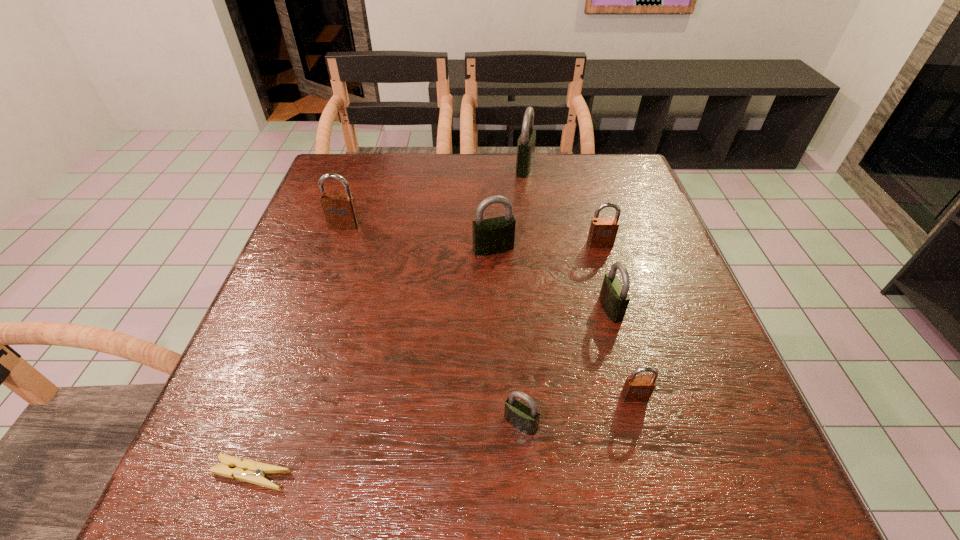
Identify the location of the sixth farthest object. (636, 388).

Identify the location of the smallest brown padlock. The width and height of the screenshot is (960, 540). (636, 388).

This screenshot has height=540, width=960. What are the coordinates of `clothespin` in the screenshot? It's located at tap(249, 471).

Locate an element on the screen. The width and height of the screenshot is (960, 540). the nearest object is located at coordinates (249, 471).

Where is `free region located 0.300m on the left of the fourth padlock from right to left`? This screenshot has height=540, width=960. free region located 0.300m on the left of the fourth padlock from right to left is located at coordinates (413, 167).

You are a GUI agent. You are given a task and a screenshot of the screen. Output one action in this format:
    pyautogui.click(x=<x>, y=<y>)
    Task: Click on the vacant region located on the back of the third nearest black padlock
    The width and height of the screenshot is (960, 540).
    Given the screenshot: What is the action you would take?
    pyautogui.click(x=492, y=191)

This screenshot has width=960, height=540. In order to click on vacant space situated on the front-facing side of the sixth nearest padlock in this screenshot , I will do `click(338, 245)`.

You are a GUI agent. You are given a task and a screenshot of the screen. Output one action in this format:
    pyautogui.click(x=<x>, y=<y>)
    Task: Click on the free point located on the front-facing side of the second smallest brown padlock
    This screenshot has height=540, width=960.
    Given the screenshot: What is the action you would take?
    pyautogui.click(x=606, y=265)

You are a GUI agent. You are given a task and a screenshot of the screen. Output one action in this format:
    pyautogui.click(x=<x>, y=<y>)
    Task: Click on the blank area located on the front of the rightmost black padlock
    The height and width of the screenshot is (540, 960).
    Given the screenshot: What is the action you would take?
    pyautogui.click(x=653, y=463)

The width and height of the screenshot is (960, 540). I want to click on free space located on the left of the nearest black padlock, so click(378, 423).